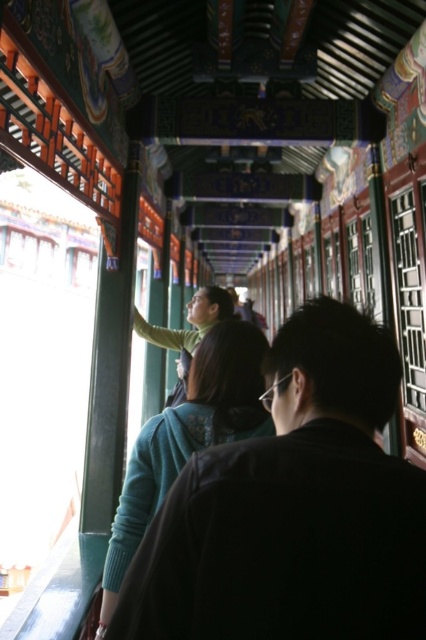
Question: Which object is farther from the camera taking this photo?

Choices:
 (A) black matte jacket at center
 (B) teal knitted sweater at center
 (C) matte green sweater at center

Answer: (C)

Question: Is black matte jacket at center positioned at the back of matte green sweater at center?

Choices:
 (A) no
 (B) yes

Answer: (A)

Question: Can you confirm if black matte jacket at center is positioned to the left of teal knitted sweater at center?

Choices:
 (A) yes
 (B) no

Answer: (B)

Question: Estimate the real-world distances between objects in this image. Which object is closer to the teal knitted sweater at center?

Choices:
 (A) black matte jacket at center
 (B) matte green sweater at center

Answer: (A)

Question: Which object is positioned closest to the teal knitted sweater at center?

Choices:
 (A) matte green sweater at center
 (B) black matte jacket at center

Answer: (B)

Question: Does black matte jacket at center appear on the right side of teal knitted sweater at center?

Choices:
 (A) yes
 (B) no

Answer: (A)